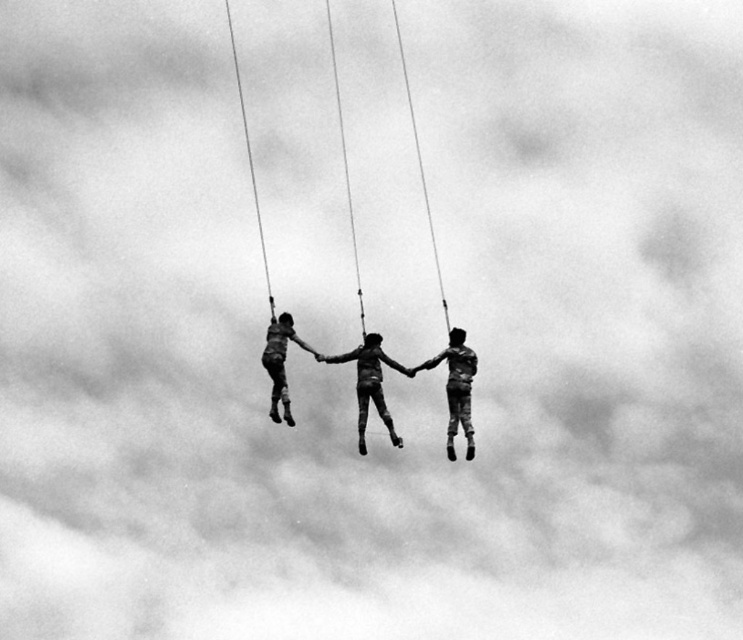
Does dark gray fabric person at center appear on the left side of matte black pants at center?

Incorrect, dark gray fabric person at center is not on the left side of matte black pants at center.

Identify the location of dark gray fabric person at center. The height and width of the screenshot is (640, 743). (369, 384).

Is point (369, 362) closer to viewer compared to point (262, 362)?

Yes, it is.

Locate an element on the screen. Image resolution: width=743 pixels, height=640 pixels. dark gray fabric person at center is located at coordinates (369, 384).

Who is more distant from viewer, (457, 358) or (379, 340)?

The point (379, 340) is behind.

Can you confirm if smooth fabric pants at center is positioned to the left of dark gray fabric person at center?

In fact, smooth fabric pants at center is to the right of dark gray fabric person at center.

This screenshot has width=743, height=640. What are the coordinates of `smooth fabric pants at center` in the screenshot? It's located at (455, 388).

Does point (279, 330) come in front of point (467, 428)?

No, it is not.

I want to click on smooth fabric couple at center, so coord(337,362).